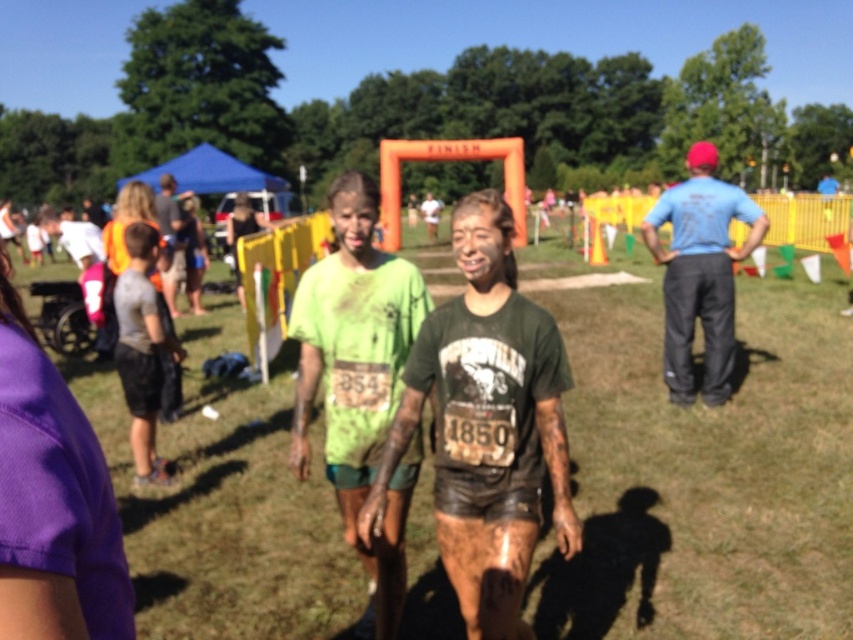
You are a photographer at the mud run event. You need to capture a wide shot that includes both the purple fabric at lower left and the blue cotton shirt at right. Given their sizes, which object should you focus on to ensure both fit in the frame?

The purple fabric at lower left has a smaller width than the blue cotton shirt at right, so focusing on the blue cotton shirt at right would help ensure both fit in the frame since it occupies more space.

You are a photographer at the event and want to capture a photo where both the purple fabric at lower left and the blue cotton shirt at right are visible. Given their heights, which object should you focus on to ensure both are in frame?

The purple fabric at lower left has a lesser height compared to the blue cotton shirt at right. To ensure both are visible, focus on the purple fabric at lower left since it is shorter and adjust the camera angle to include the taller blue cotton shirt at right.